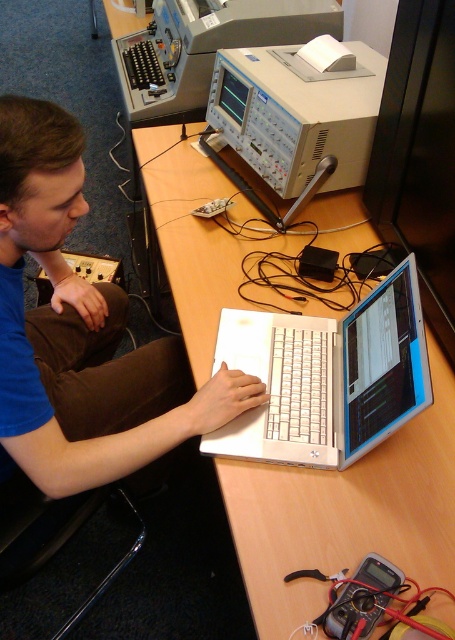
You are a technician trying to adjust the settings on the oscilloscope. You notice two calibration points on the oscilloscope display labeled as point 1 at coordinate point (146, 52) and point 2 at coordinate point (119, 333). Which point is closer to you?

Point (146, 52) is closer to you than point (119, 333) because it is further to the viewer.

You are a technician who needs to adjust the settings on the gray plastic oscilloscope at upper center while also checking the brown corduroy pants at lower left for any visible damage. Which object will require you to lean forward more to inspect closely?

The gray plastic oscilloscope at upper center requires leaning forward more because it is closer to the viewer than the brown corduroy pants at lower left, making it necessary to move closer for a detailed inspection.